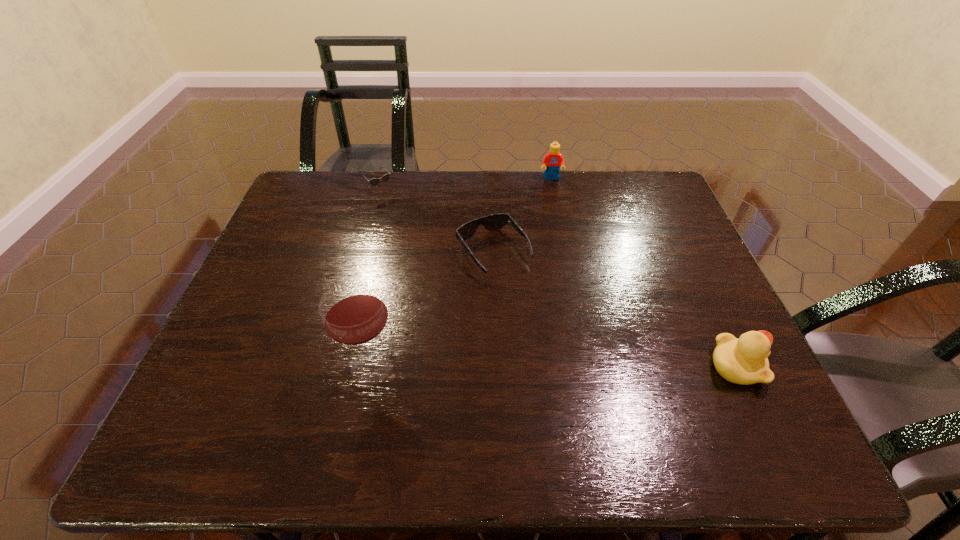
I want to click on the fourth closest object to the tallest object, so click(552, 161).

Choose which object is the nearest neighbor to the Lego. Please provide its 2D coordinates. Your answer should be formatted as a tuple, i.e. [(x, y)], where the tuple contains the x and y coordinates of a point satisfying the conditions above.

[(492, 222)]

The height and width of the screenshot is (540, 960). Identify the location of free spot that satisfies the following two spatial constraints: 1. on the front side of the rightmost object; 2. on the front-facing side of the farther sunglasses. (340, 366).